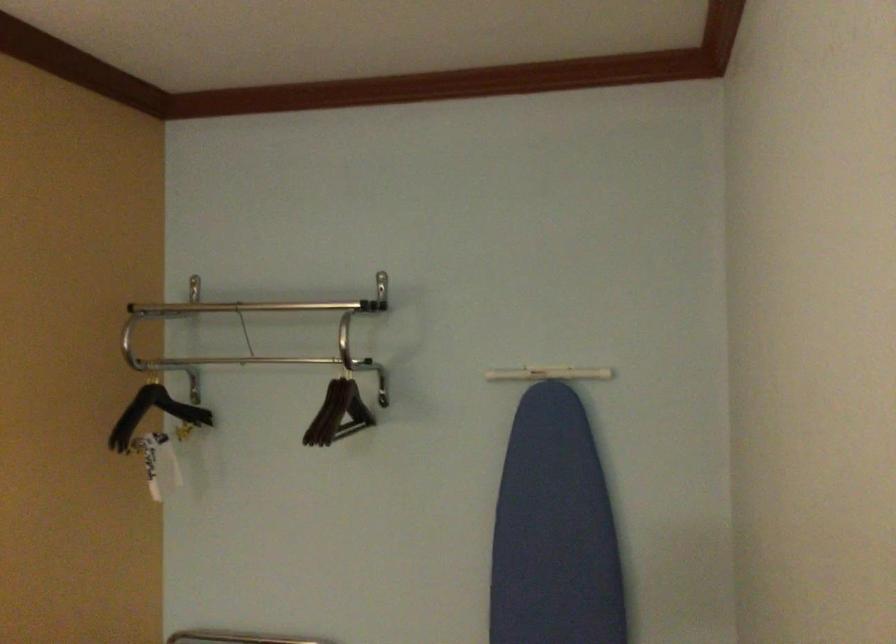
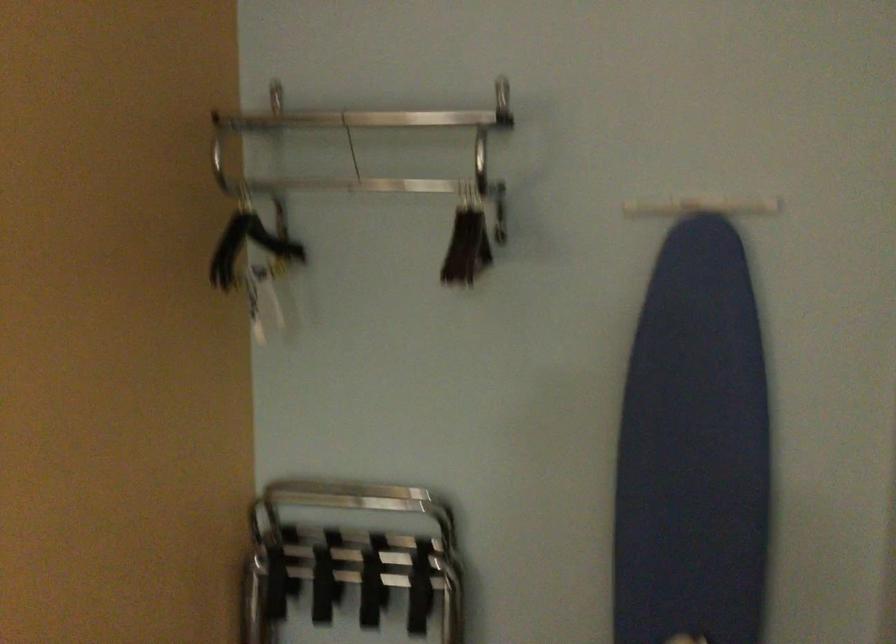
Question: The images are taken continuously from a first-person perspective. In which direction is your viewpoint rotating?

Choices:
 (A) Left
 (B) Right
 (C) Up
 (D) Down

Answer: (D)